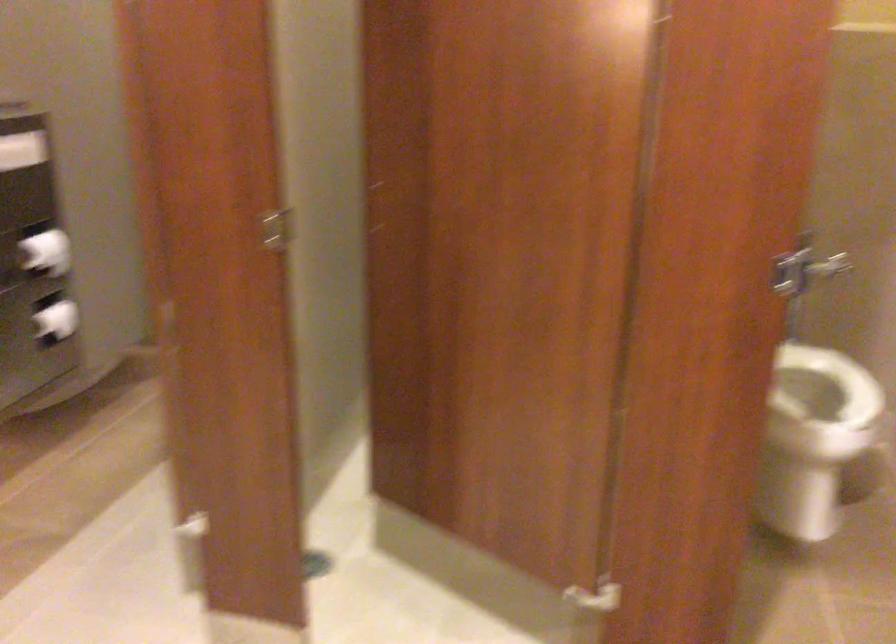
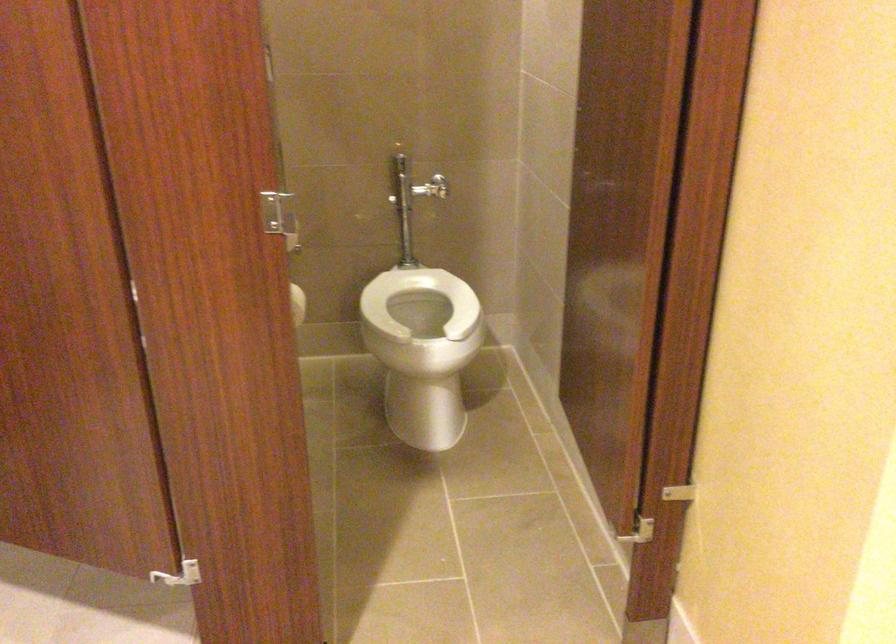
Where in the second image is the point corresponding to (x=789, y=257) from the first image?

(279, 216)